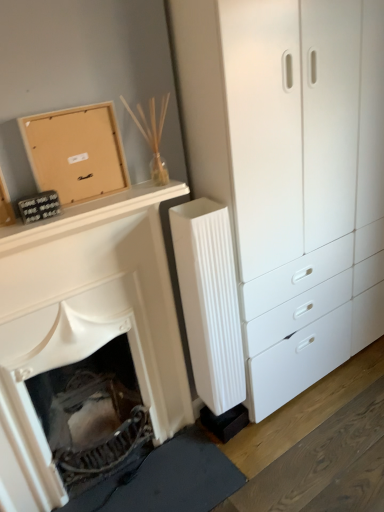
Where is `free space on the front side of white ribbed radiator at center`? This screenshot has height=512, width=384. free space on the front side of white ribbed radiator at center is located at coordinates (244, 459).